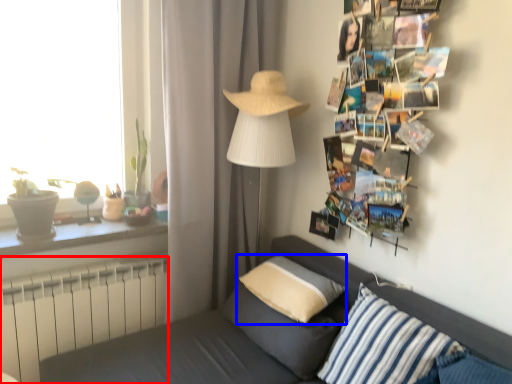
Question: Which object appears closest to the camera in this image, radiator (highlighted by a red box) or pillow (highlighted by a blue box)?

Choices:
 (A) radiator
 (B) pillow

Answer: (B)